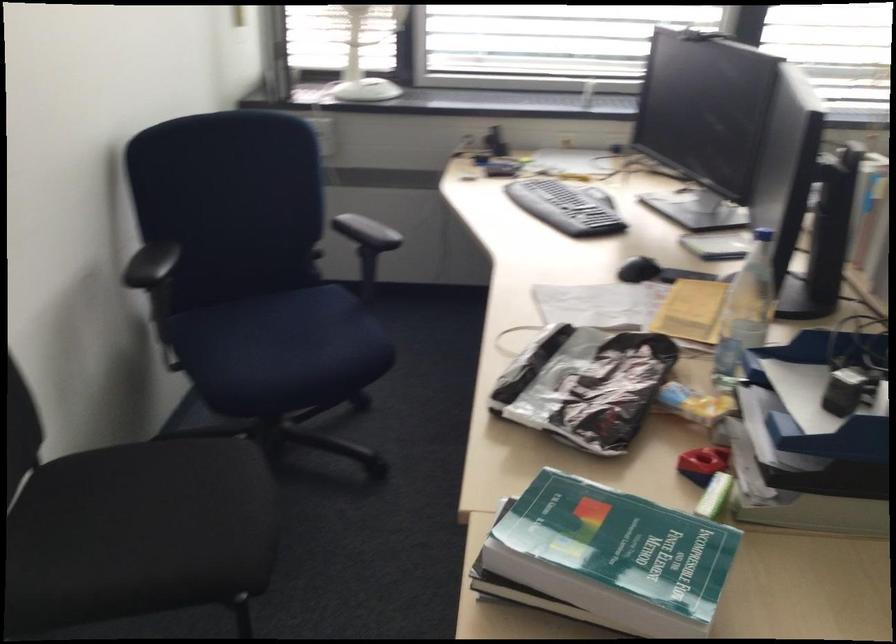
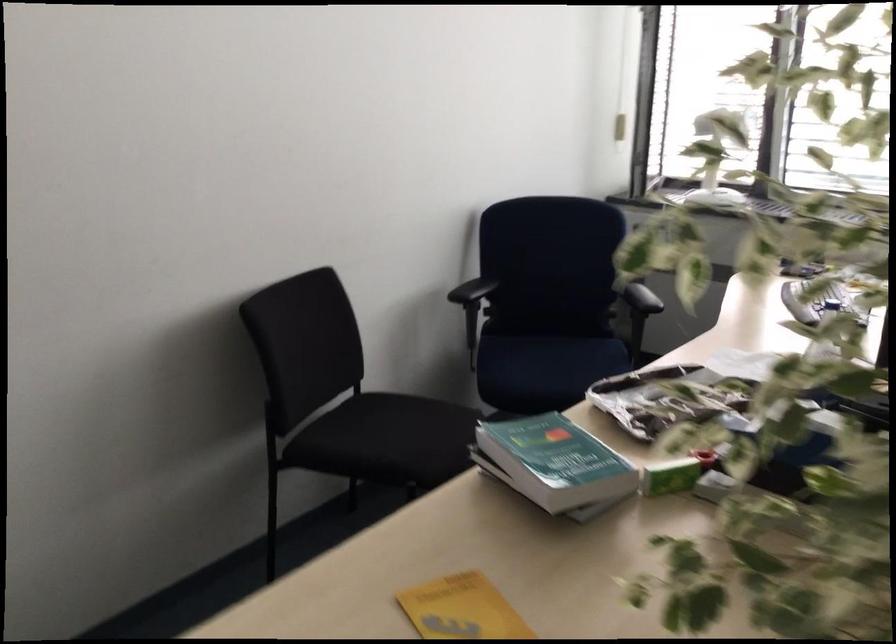
Where in the second image is the point corresponding to the point at 634,552 from the first image?

(554, 462)